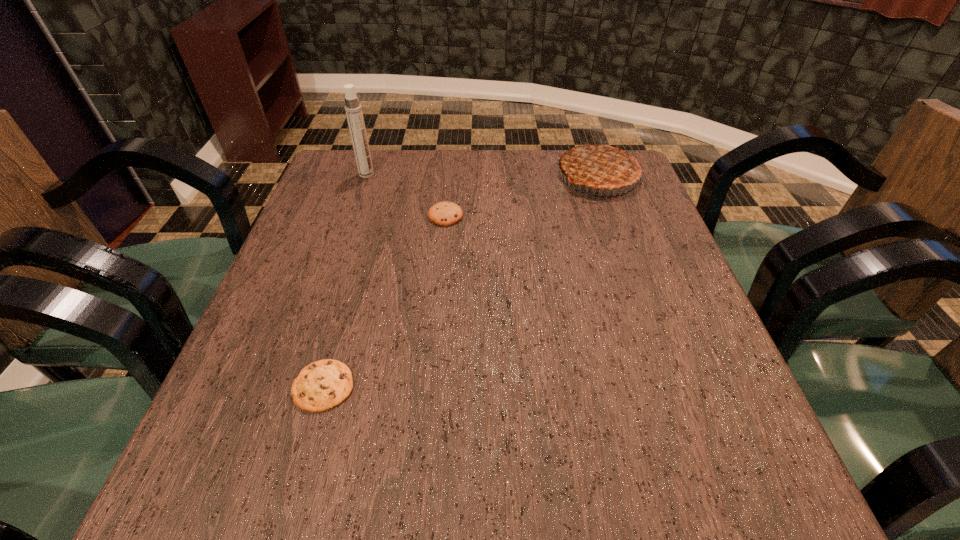
The width and height of the screenshot is (960, 540). What are the coordinates of `free space at the left edge of the desktop` in the screenshot? It's located at (326, 276).

In the image, there is a desktop. Where is `vacant area at the right edge`? The height and width of the screenshot is (540, 960). vacant area at the right edge is located at coordinates coord(668,421).

This screenshot has height=540, width=960. In order to click on vacant space at the far left corner of the desktop in this screenshot , I will do `click(386, 154)`.

Locate an element on the screen. Image resolution: width=960 pixels, height=540 pixels. blank region between the third farthest object and the nearest object is located at coordinates coord(385,301).

You are a GUI agent. You are given a task and a screenshot of the screen. Output one action in this format:
    pyautogui.click(x=<x>, y=<y>)
    Task: Click on the vacant area that lies between the shortest object and the third tallest object
    
    Given the screenshot: What is the action you would take?
    pyautogui.click(x=385, y=301)

The height and width of the screenshot is (540, 960). In order to click on unoccupied area between the second shortest object and the nearer cookie in this screenshot , I will do `click(385, 301)`.

The image size is (960, 540). Identify the location of free space between the nearest object and the right cookie. (385, 301).

Image resolution: width=960 pixels, height=540 pixels. Identify the location of free point between the farther cookie and the rightmost object. (521, 195).

Where is `free space between the pie and the tallest object`? The width and height of the screenshot is (960, 540). free space between the pie and the tallest object is located at coordinates (482, 176).

Locate an element on the screen. This screenshot has width=960, height=540. free space between the farther cookie and the pie is located at coordinates (521, 195).